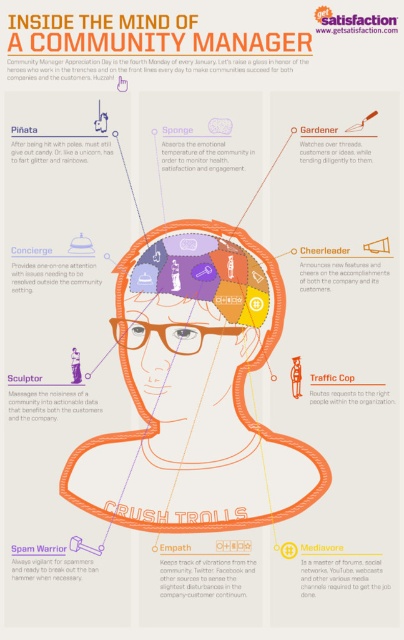
Based on the provided scene, which object is located below the other? The matte purple brain at center or the orange matte head at center?

The matte purple brain at center is positioned under the orange matte head at center.